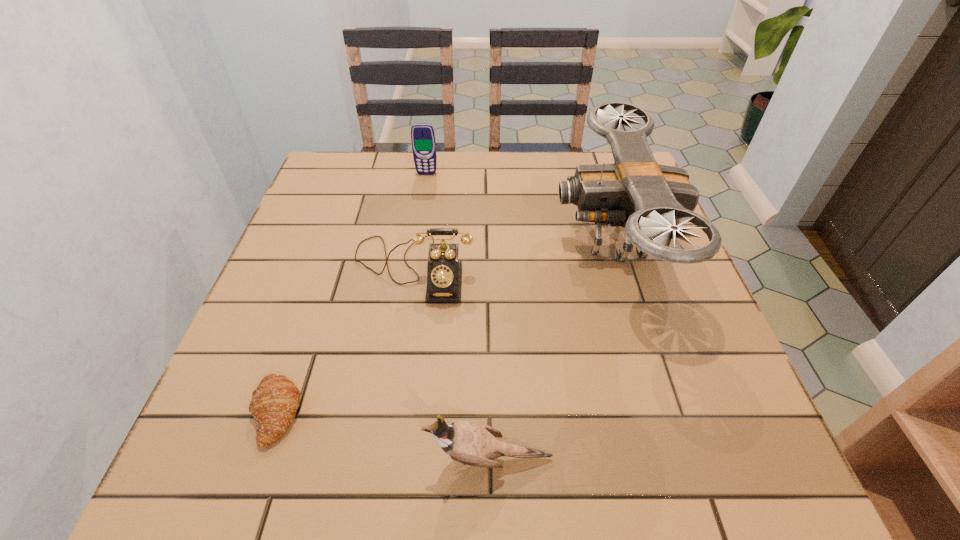
Select which object is the third closest to the bird. Please provide its 2D coordinates. Your answer should be formatted as a tuple, i.e. [(x, y)], where the tuple contains the x and y coordinates of a point satisfying the conditions above.

[(444, 272)]